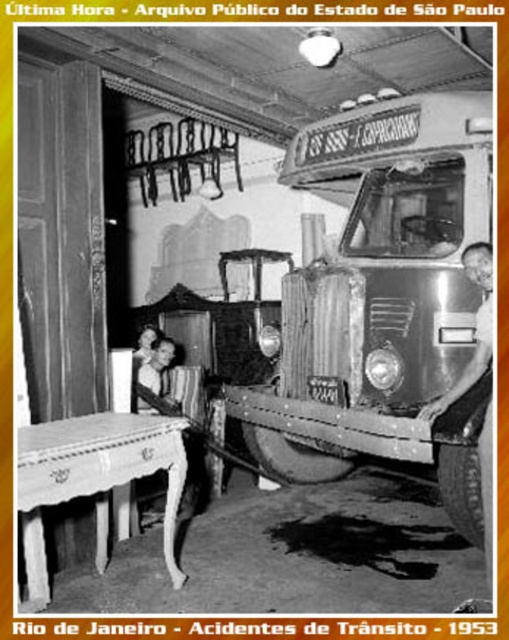
You are a customer sitting at the white wood table at lower left and want to exit the restaurant through the door behind the shiny silver truck at right. Can you easily walk around the truck to reach the door?

The white wood table at lower left is closer to the viewer than the shiny silver truck at right, so the truck is further away from you. Therefore, you can easily walk around the truck to reach the door behind it.

You are a photographer standing at the camera position in the scene. You want to place a small tripod between the white wood table at lower left and the camera. Is there enough space to place the tripod?

The distance between the white wood table at lower left and the camera is 3.06 meters, so yes, there is enough space to place the tripod between them since 3.06 meters is sufficient for a small tripod.